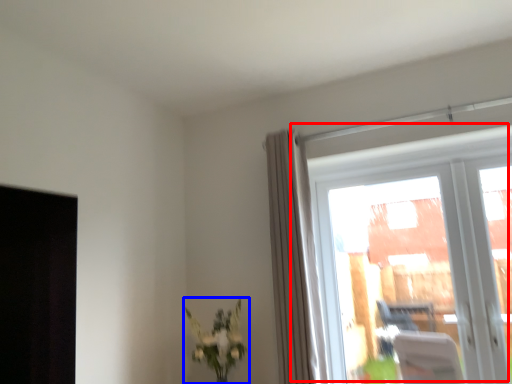
Question: Which object is further to the camera taking this photo, window (highlighted by a red box) or houseplant (highlighted by a blue box)?

Choices:
 (A) window
 (B) houseplant

Answer: (B)